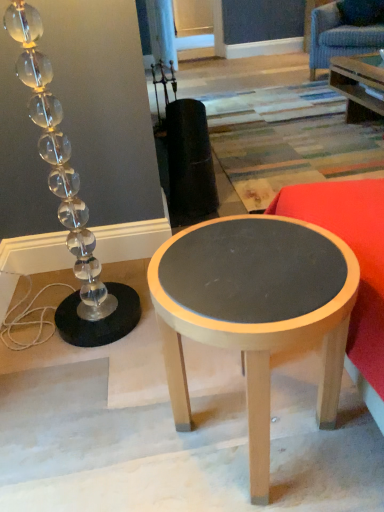
Question: Considering the relative sizes of blue fabric swivel chair at upper right and matte red fabric couch at right in the image provided, is blue fabric swivel chair at upper right bigger than matte red fabric couch at right?

Choices:
 (A) no
 (B) yes

Answer: (B)

Question: From a real-world perspective, is blue fabric swivel chair at upper right under matte red fabric couch at right?

Choices:
 (A) yes
 (B) no

Answer: (B)

Question: Is blue fabric swivel chair at upper right outside of matte red fabric couch at right?

Choices:
 (A) no
 (B) yes

Answer: (B)

Question: Is blue fabric swivel chair at upper right surrounding matte red fabric couch at right?

Choices:
 (A) yes
 (B) no

Answer: (B)

Question: Does blue fabric swivel chair at upper right turn towards matte red fabric couch at right?

Choices:
 (A) no
 (B) yes

Answer: (B)

Question: In terms of width, does matte gray wood table at center look wider or thinner when compared to clear glass lamp at left?

Choices:
 (A) thin
 (B) wide

Answer: (B)

Question: From a real-world perspective, is matte gray wood table at center physically located above or below clear glass lamp at left?

Choices:
 (A) below
 (B) above

Answer: (A)

Question: Considering the positions of matte gray wood table at center and clear glass lamp at left in the image, is matte gray wood table at center taller or shorter than clear glass lamp at left?

Choices:
 (A) short
 (B) tall

Answer: (A)

Question: Considering the relative positions of matte gray wood table at center and clear glass lamp at left in the image provided, is matte gray wood table at center to the left or to the right of clear glass lamp at left?

Choices:
 (A) right
 (B) left

Answer: (A)

Question: From a real-world perspective, is blue fabric swivel chair at upper right above or below matte red fabric couch at right?

Choices:
 (A) above
 (B) below

Answer: (A)

Question: From the image's perspective, relative to matte red fabric couch at right, is blue fabric swivel chair at upper right above or below?

Choices:
 (A) below
 (B) above

Answer: (B)

Question: Considering the positions of blue fabric swivel chair at upper right and matte red fabric couch at right in the image, is blue fabric swivel chair at upper right taller or shorter than matte red fabric couch at right?

Choices:
 (A) short
 (B) tall

Answer: (B)

Question: Is blue fabric swivel chair at upper right wider or thinner than matte red fabric couch at right?

Choices:
 (A) wide
 (B) thin

Answer: (B)

Question: From the image's perspective, is blue fabric swivel chair at upper right above or below matte gray wood table at center?

Choices:
 (A) below
 (B) above

Answer: (B)

Question: Do you think blue fabric swivel chair at upper right is within matte gray wood table at center, or outside of it?

Choices:
 (A) inside
 (B) outside

Answer: (B)